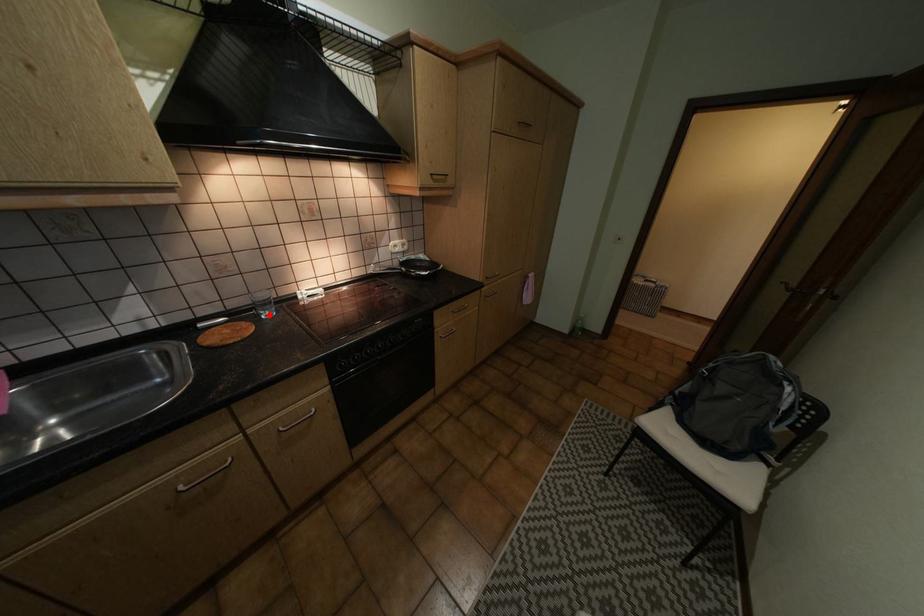
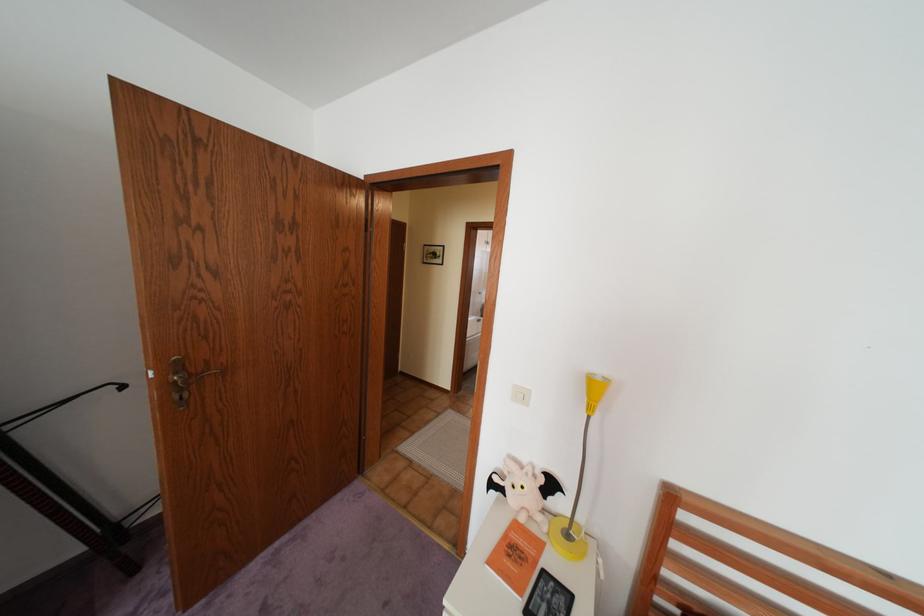
Question: I am providing you with two images of the same scene from different viewpoints. A red point is marked on the first image. Can you still see the location of the red point in image 2?

Choices:
 (A) Yes
 (B) No

Answer: (B)